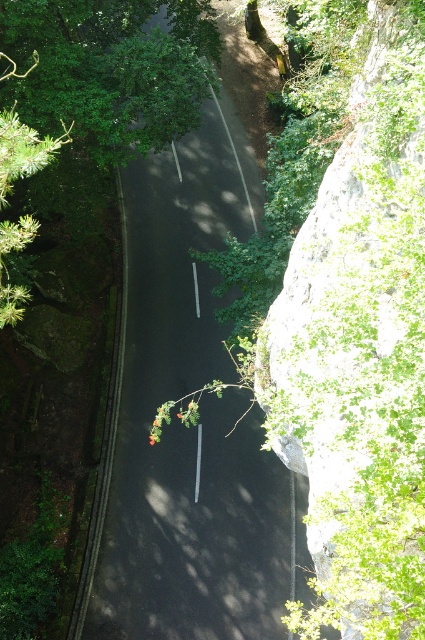
Is black asphalt road at center positioned at the back of green leafy tree at upper left?

Yes, black asphalt road at center is behind green leafy tree at upper left.

Locate an element on the screen. black asphalt road at center is located at coordinates (192, 426).

The width and height of the screenshot is (425, 640). Find the location of `black asphalt road at center`. black asphalt road at center is located at coordinates (192, 426).